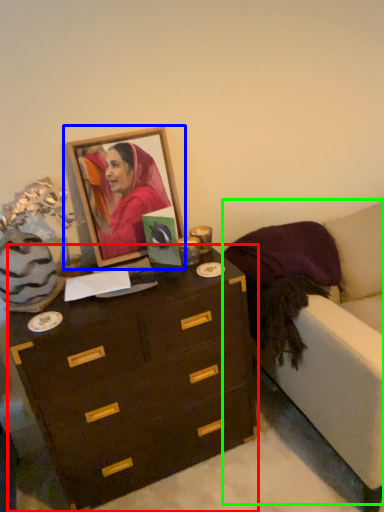
Question: Which object is the closest to the chest of drawers (highlighted by a red box)? Choose among these: picture frame (highlighted by a blue box) or armchair (highlighted by a green box).

Choices:
 (A) picture frame
 (B) armchair

Answer: (B)